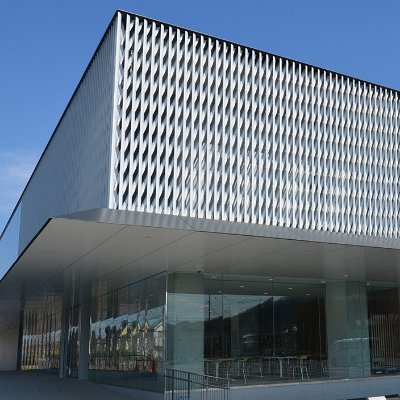
At what (x,y) coordinates should I click in order to perform the action: click on pillar. Please return your answer as a coordinate pair (x, y). Looking at the image, I should click on (349, 335), (194, 333).